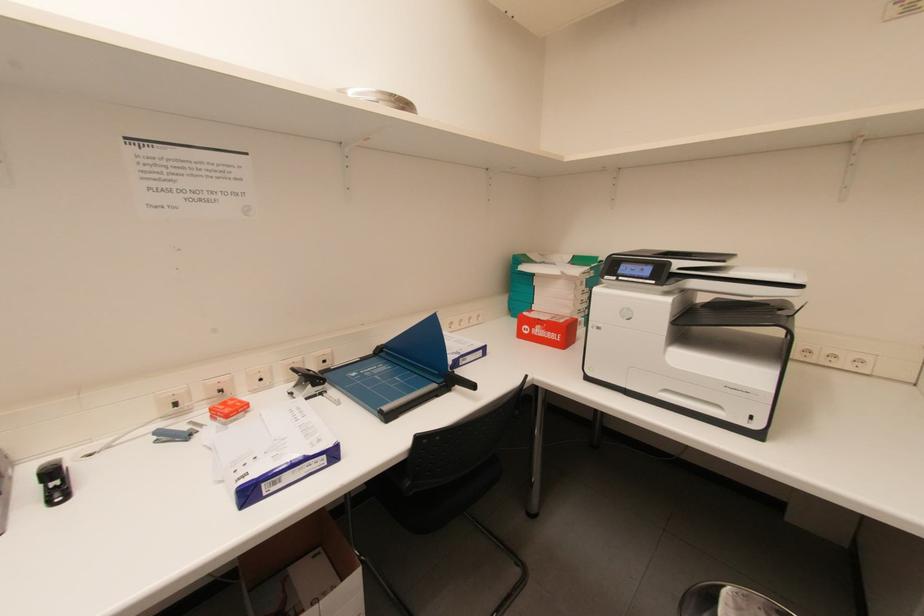
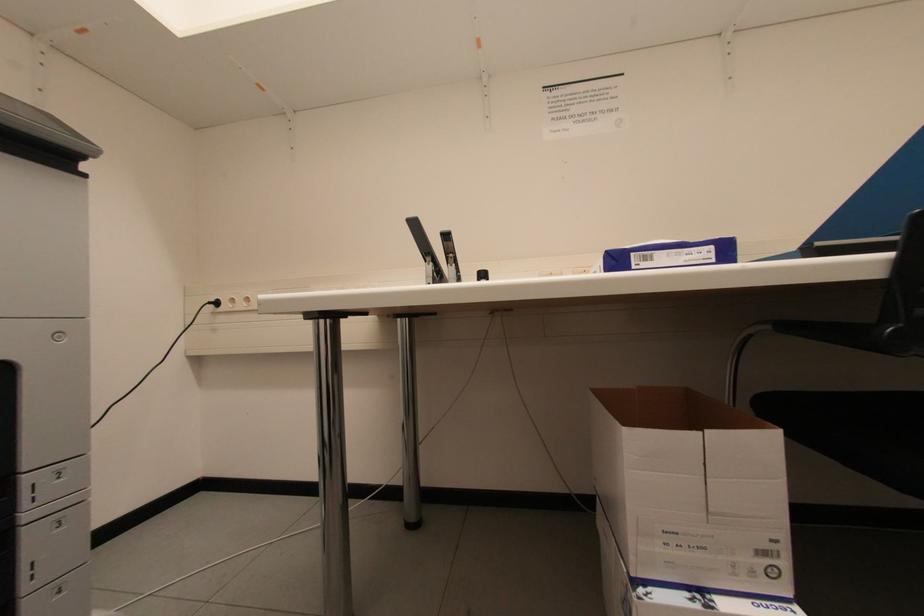
Question: The camera is either moving clockwise (left) or counter-clockwise (right) around the object. The first image is from the beginning of the video and the second image is from the end. Is the camera moving left or right when shooting the video?

Choices:
 (A) Left
 (B) Right

Answer: (B)